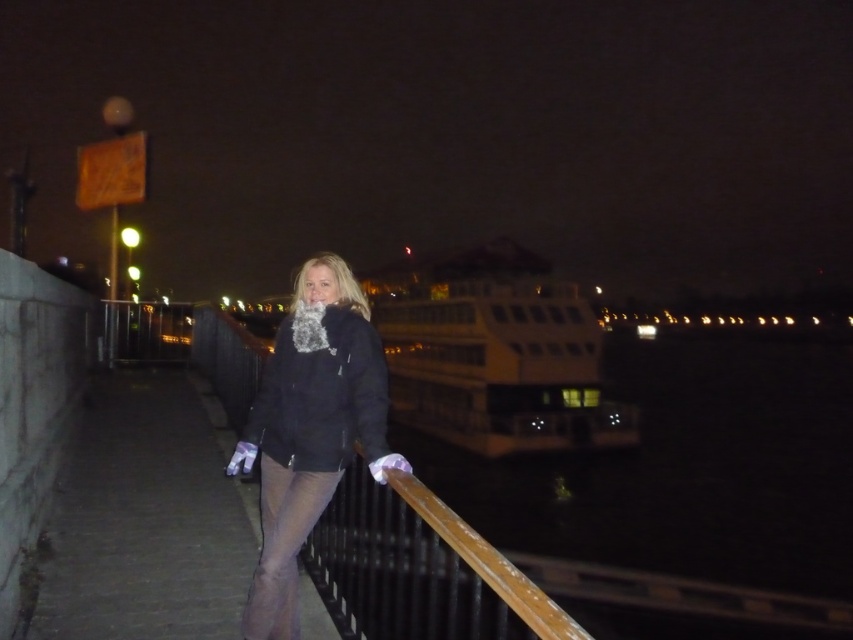
Which is more to the left, wooden at center or matte black jacket at center?

matte black jacket at center

Can you confirm if wooden at center is positioned below matte black jacket at center?

Correct, wooden at center is located below matte black jacket at center.

Does point (403, 621) come in front of point (318, 506)?

Yes, it is.

This screenshot has width=853, height=640. Identify the location of wooden at center. (418, 568).